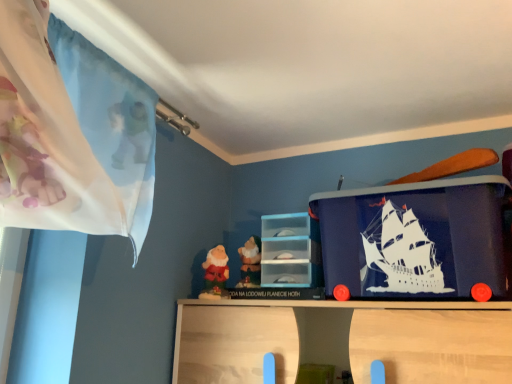
Question: Is transparent plastic drawer at center looking in the opposite direction of velvet red dwarf at center, placed as the second toy when sorted from right to left?

Choices:
 (A) yes
 (B) no

Answer: (B)

Question: Is the position of transparent plastic drawer at center less distant than that of velvet red dwarf at center, placed as the second toy when sorted from right to left?

Choices:
 (A) no
 (B) yes

Answer: (B)

Question: Is transparent plastic drawer at center taller than velvet red dwarf at center, which is counted as the 1th toy, starting from the left?

Choices:
 (A) no
 (B) yes

Answer: (B)

Question: Could you tell me if transparent plastic drawer at center is facing velvet red dwarf at center, placed as the second toy when sorted from right to left?

Choices:
 (A) yes
 (B) no

Answer: (B)

Question: Can you confirm if transparent plastic drawer at center is bigger than velvet red dwarf at center, which is counted as the 1th toy, starting from the left?

Choices:
 (A) yes
 (B) no

Answer: (A)

Question: Is the depth of transparent plastic drawer at center greater than that of velvet red dwarf at center, placed as the second toy when sorted from right to left?

Choices:
 (A) yes
 (B) no

Answer: (B)

Question: Is transparent plastic drawer at center bigger than matte plastic dwarf at center, the 1th toy from the right?

Choices:
 (A) no
 (B) yes

Answer: (B)

Question: Can you confirm if transparent plastic drawer at center is smaller than matte plastic dwarf at center, the 1th toy from the right?

Choices:
 (A) yes
 (B) no

Answer: (B)

Question: Is matte plastic dwarf at center, the 1th toy from the right, completely or partially inside transparent plastic drawer at center?

Choices:
 (A) yes
 (B) no

Answer: (B)

Question: Would you consider transparent plastic drawer at center to be distant from matte plastic dwarf at center, the 1th toy from the right?

Choices:
 (A) no
 (B) yes

Answer: (A)

Question: Considering the relative positions of transparent plastic drawer at center and matte plastic dwarf at center, the 1th toy from the right, in the image provided, is transparent plastic drawer at center to the left of matte plastic dwarf at center, the 1th toy from the right, from the viewer's perspective?

Choices:
 (A) yes
 (B) no

Answer: (B)

Question: From the image's perspective, would you say transparent plastic drawer at center is positioned over matte plastic dwarf at center, marked as the second toy in a left-to-right arrangement?

Choices:
 (A) no
 (B) yes

Answer: (B)

Question: Does matte plastic dwarf at center, the 1th toy from the right, have a greater width compared to transparent plastic drawer at center?

Choices:
 (A) yes
 (B) no

Answer: (B)